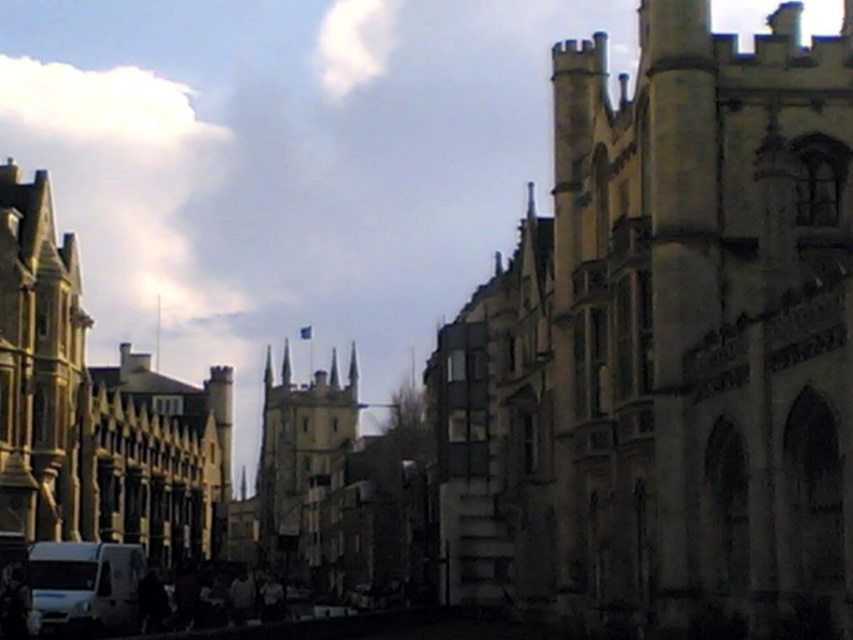
Is point (347, 387) behind point (93, 563)?

That is True.

Identify the location of stone spire at center. This screenshot has width=853, height=640. (x=300, y=454).